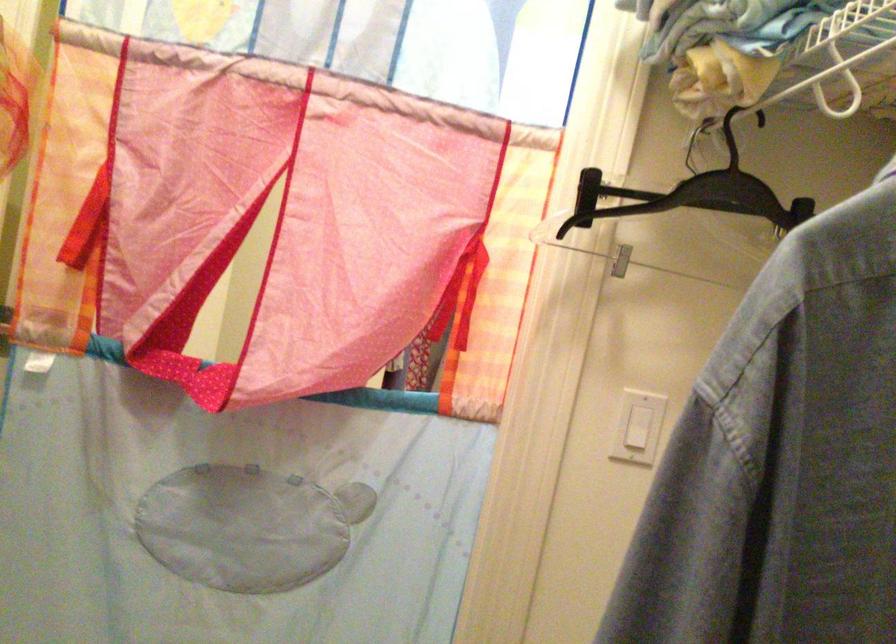
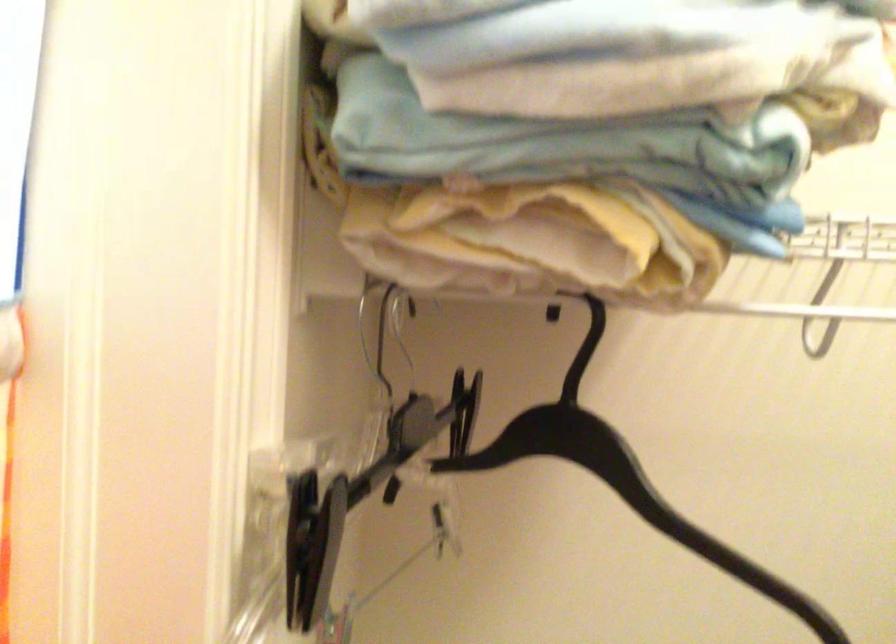
In the second image, find the point that corresponds to [703,194] in the first image.

(624, 478)